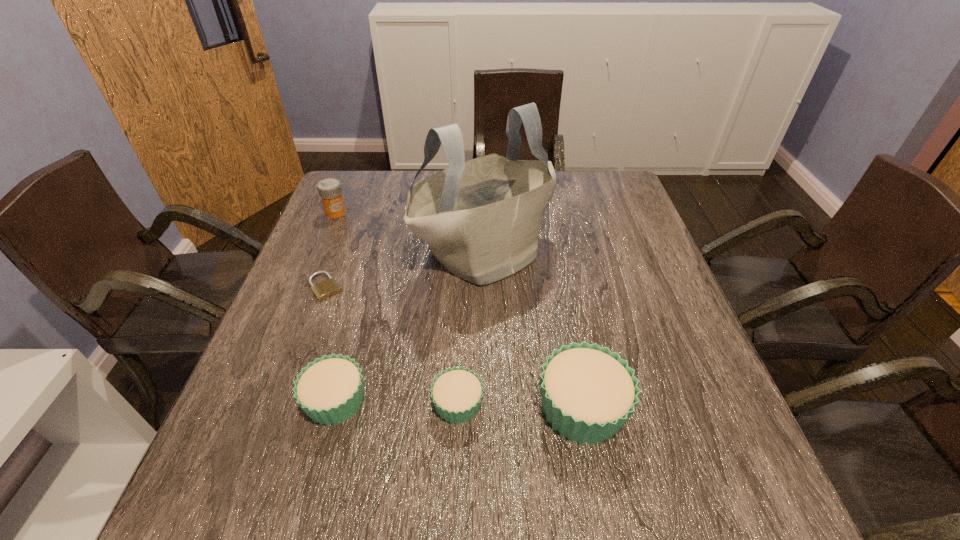
Where is `the leftmost cupcake`? the leftmost cupcake is located at coordinates (330, 389).

This screenshot has height=540, width=960. I want to click on the second tallest cupcake, so click(330, 389).

The width and height of the screenshot is (960, 540). Find the location of `the second cupcake from left to right`. the second cupcake from left to right is located at coordinates (457, 393).

Where is `the fifth tallest object`? This screenshot has height=540, width=960. the fifth tallest object is located at coordinates 457,393.

In order to click on the tallest cupcake in this screenshot , I will do `click(588, 393)`.

Find the location of a particular element. The image size is (960, 540). medicine is located at coordinates (329, 189).

Where is `shopping bag`? shopping bag is located at coordinates (481, 218).

The image size is (960, 540). What are the coordinates of `padlock` in the screenshot? It's located at (323, 290).

You are a GUI agent. You are given a task and a screenshot of the screen. Output one action in this format:
    pyautogui.click(x=<x>, y=<y>)
    Task: Click on the free location located on the back of the second tallest cupcake
    The height and width of the screenshot is (540, 960).
    Given the screenshot: What is the action you would take?
    pyautogui.click(x=376, y=247)

This screenshot has width=960, height=540. I want to click on vacant space located on the left of the second shortest object, so click(x=321, y=404).